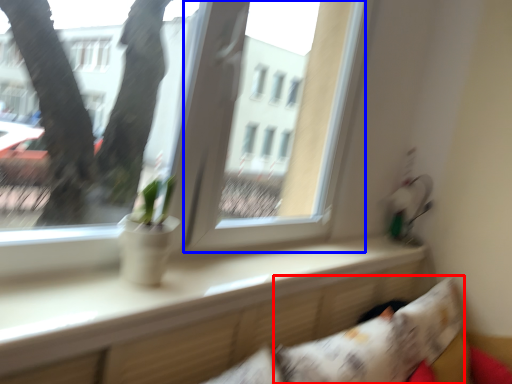
Question: Which object appears farthest to the camera in this image, pillow (highlighted by a red box) or window screen (highlighted by a blue box)?

Choices:
 (A) pillow
 (B) window screen

Answer: (B)